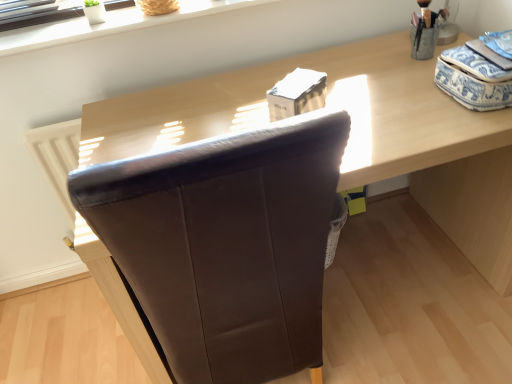
Locate an element on the screen. The image size is (512, 384). free space between brown leather chair at center and brown leather chair at center is located at coordinates (402, 346).